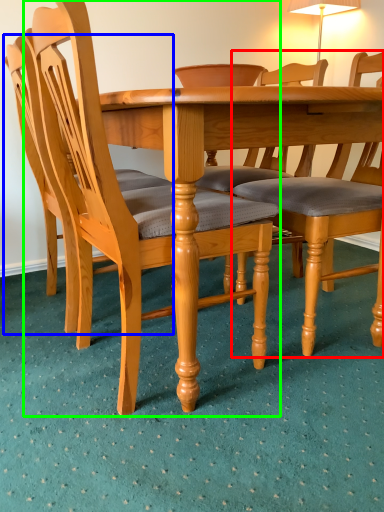
Question: Which object is positioned farthest from chair (highlighted by a red box)? Select from chair (highlighted by a blue box) and chair (highlighted by a green box).

Choices:
 (A) chair
 (B) chair

Answer: (A)